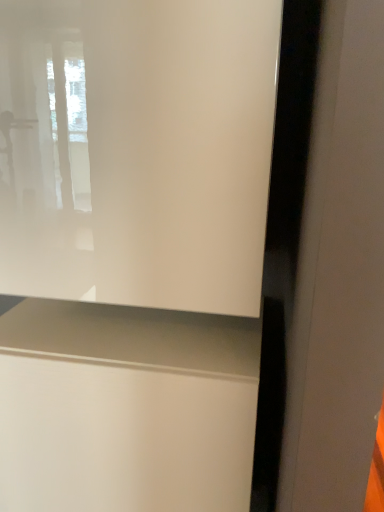
Where is `free point below transparent glass window at upper left (from a real-world perspective)`? This screenshot has width=384, height=512. free point below transparent glass window at upper left (from a real-world perspective) is located at coordinates pos(106,322).